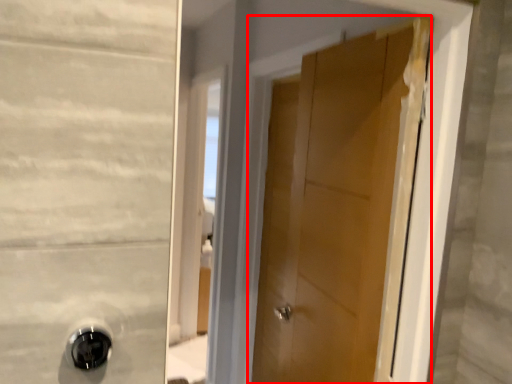
Question: From the image's perspective, where is door (annotated by the red box) located in relation to door handle in the image?

Choices:
 (A) below
 (B) above

Answer: (B)